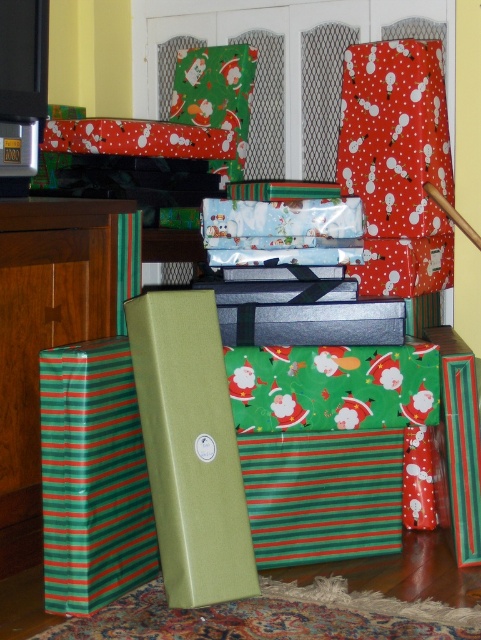
Question: Is green striped paper at lower left below green striped box at left?

Choices:
 (A) yes
 (B) no

Answer: (A)

Question: Is the position of green striped paper at lower left less distant than that of green striped box at left?

Choices:
 (A) yes
 (B) no

Answer: (B)

Question: Can you confirm if green striped paper at lower left is positioned to the left of green striped box at left?

Choices:
 (A) yes
 (B) no

Answer: (B)

Question: Which point is closer to the camera?

Choices:
 (A) (55, 216)
 (B) (54, 468)

Answer: (B)